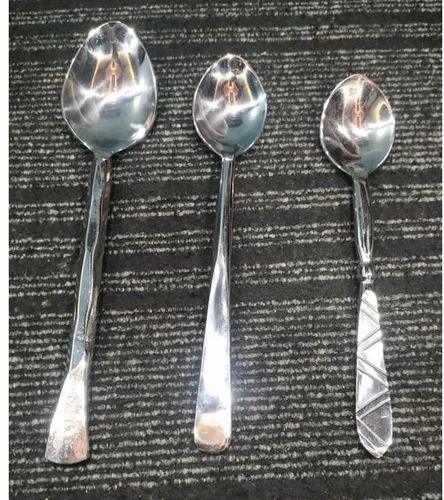
Identify the location of handle. This screenshot has height=500, width=444. (221, 392).